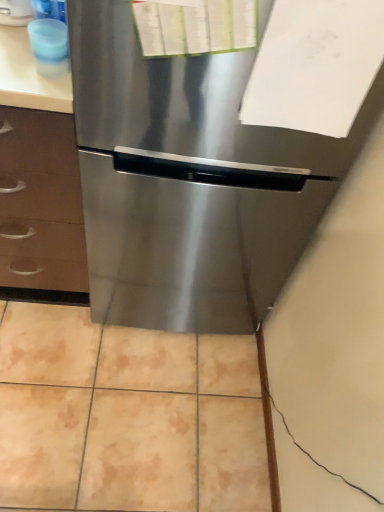
Describe the element at coordinates (315, 65) in the screenshot. The height and width of the screenshot is (512, 384). I see `white matte paper at upper right` at that location.

Where is `beige ceramic tile at center`? Image resolution: width=384 pixels, height=512 pixels. beige ceramic tile at center is located at coordinates (127, 416).

This screenshot has width=384, height=512. What do you see at coordinates (189, 181) in the screenshot?
I see `stainless steel refrigerator at center` at bounding box center [189, 181].

At what (x,y) coordinates should I click in order to perform the action: click on white matte paper at upper right. Please return your answer as a coordinate pair (x, y). The height and width of the screenshot is (512, 384). Looking at the image, I should click on (315, 65).

Considering the points (362, 60) and (267, 482), which point is in front, point (362, 60) or point (267, 482)?

Positioned in front is point (362, 60).

Measure the distance between white matte paper at upper right and beige ceramic tile at center.

white matte paper at upper right is 3.36 feet from beige ceramic tile at center.

Which object is closer to the camera, white matte paper at upper right or beige ceramic tile at center?

Positioned in front is white matte paper at upper right.

Is white matte paper at upper right smaller than beige ceramic tile at center?

Correct, white matte paper at upper right occupies less space than beige ceramic tile at center.

Can you tell me how much stainless steel refrigerator at center and beige ceramic tile at center differ in facing direction?

There is a 91.3-degree angle between the facing directions of stainless steel refrigerator at center and beige ceramic tile at center.

Is stainless steel refrigerator at center looking in the opposite direction of beige ceramic tile at center?

No, stainless steel refrigerator at center is not facing the opposite direction of beige ceramic tile at center.

Between stainless steel refrigerator at center and beige ceramic tile at center, which one has larger size?

stainless steel refrigerator at center is bigger.

Is stainless steel refrigerator at center touching beige ceramic tile at center?

No, stainless steel refrigerator at center is not next to beige ceramic tile at center.

In the scene shown: Considering the relative positions of stainless steel refrigerator at center and translucent blue cup at upper left in the image provided, is stainless steel refrigerator at center behind translucent blue cup at upper left?

No, stainless steel refrigerator at center is closer to the viewer.

Does point (146, 74) come behind point (30, 35)?

No, it is not.

From the image's perspective, is stainless steel refrigerator at center located above or below translucent blue cup at upper left?

From the image's perspective, stainless steel refrigerator at center appears below translucent blue cup at upper left.

Is stainless steel refrigerator at center spatially inside translucent blue cup at upper left, or outside of it?

stainless steel refrigerator at center is spatially situated outside translucent blue cup at upper left.

Can you tell me how much beige ceramic tile at center and stainless steel refrigerator at center differ in facing direction?

There is a 91.3-degree angle between the facing directions of beige ceramic tile at center and stainless steel refrigerator at center.

Is beige ceramic tile at center behind stainless steel refrigerator at center?

Yes.

Considering the relative sizes of beige ceramic tile at center and stainless steel refrigerator at center in the image provided, is beige ceramic tile at center shorter than stainless steel refrigerator at center?

Indeed, beige ceramic tile at center has a lesser height compared to stainless steel refrigerator at center.

Considering the sizes of objects beige ceramic tile at center and stainless steel refrigerator at center in the image provided, who is bigger, beige ceramic tile at center or stainless steel refrigerator at center?

stainless steel refrigerator at center is bigger.

Is stainless steel refrigerator at center directly adjacent to white matte paper at upper right?

No.

From their relative heights in the image, would you say stainless steel refrigerator at center is taller or shorter than white matte paper at upper right?

In the image, stainless steel refrigerator at center appears to be taller than white matte paper at upper right.

Does stainless steel refrigerator at center appear on the left side of white matte paper at upper right?

Yes.

From the image's perspective, is stainless steel refrigerator at center beneath white matte paper at upper right?

Yes, from the image's perspective, stainless steel refrigerator at center is beneath white matte paper at upper right.

Choose the correct answer: Is beige ceramic tile at center inside white matte paper at upper right or outside it?

beige ceramic tile at center is not enclosed by white matte paper at upper right.

Looking at their sizes, would you say beige ceramic tile at center is wider or thinner than white matte paper at upper right?

Clearly, beige ceramic tile at center has more width compared to white matte paper at upper right.

From the picture: Does beige ceramic tile at center turn towards white matte paper at upper right?

No, beige ceramic tile at center is not facing towards white matte paper at upper right.

Is beige ceramic tile at center bigger than white matte paper at upper right?

Indeed, beige ceramic tile at center has a larger size compared to white matte paper at upper right.

In the scene shown: From a real-world perspective, is translucent blue cup at upper left positioned under white matte paper at upper right based on gravity?

Indeed, from a real-world perspective, translucent blue cup at upper left is positioned beneath white matte paper at upper right.

Is translucent blue cup at upper left positioned with its back to white matte paper at upper right?

No, white matte paper at upper right is not at the back of translucent blue cup at upper left.

How many degrees apart are the facing directions of translucent blue cup at upper left and white matte paper at upper right?

2.48 degrees separate the facing orientations of translucent blue cup at upper left and white matte paper at upper right.

Can you see translucent blue cup at upper left touching white matte paper at upper right?

No, translucent blue cup at upper left is not beside white matte paper at upper right.

You are a GUI agent. You are given a task and a screenshot of the screen. Output one action in this format:
    pyautogui.click(x=<x>, y=<y>)
    Task: Click on the paper located on the right of beige ceramic tile at center
    The image size is (384, 512).
    Given the screenshot: What is the action you would take?
    pyautogui.click(x=315, y=65)

At what (x,y) coordinates should I click in order to perform the action: click on refrigerator above the beige ceramic tile at center (from a real-world perspective). Please return your answer as a coordinate pair (x, y). This screenshot has width=384, height=512. Looking at the image, I should click on (189, 181).

Looking at the image, which one is located closer to translucent blue cup at upper left, white matte paper at upper right or beige ceramic tile at center?

white matte paper at upper right.

In the scene shown: Considering their positions, is stainless steel refrigerator at center positioned further to translucent blue cup at upper left than white matte paper at upper right?

Based on the image, white matte paper at upper right appears to be further to translucent blue cup at upper left.

Considering their positions, is beige ceramic tile at center positioned further to translucent blue cup at upper left than white matte paper at upper right?

beige ceramic tile at center.

When comparing their distances from white matte paper at upper right, does translucent blue cup at upper left or beige ceramic tile at center seem further?

beige ceramic tile at center is further to white matte paper at upper right.

Based on their spatial positions, is stainless steel refrigerator at center or translucent blue cup at upper left closer to white matte paper at upper right?

stainless steel refrigerator at center is positioned closer to the anchor white matte paper at upper right.

From the image, which object appears to be nearer to stainless steel refrigerator at center, white matte paper at upper right or beige ceramic tile at center?

white matte paper at upper right lies closer to stainless steel refrigerator at center than the other object.

From the image, which object appears to be farther from white matte paper at upper right, beige ceramic tile at center or translucent blue cup at upper left?

Based on the image, beige ceramic tile at center appears to be further to white matte paper at upper right.

Looking at the image, which one is located closer to translucent blue cup at upper left, stainless steel refrigerator at center or beige ceramic tile at center?

stainless steel refrigerator at center.

The height and width of the screenshot is (512, 384). Find the location of `refrigerator between translucent blue cup at upper left and white matte paper at upper right`. refrigerator between translucent blue cup at upper left and white matte paper at upper right is located at coordinates (189, 181).

Locate an element on the screen. This screenshot has height=512, width=384. paper that lies between translucent blue cup at upper left and beige ceramic tile at center from top to bottom is located at coordinates (315, 65).

Where is `refrigerator between white matte paper at upper right and beige ceramic tile at center from top to bottom`? The image size is (384, 512). refrigerator between white matte paper at upper right and beige ceramic tile at center from top to bottom is located at coordinates (189, 181).

Where is `refrigerator between translucent blue cup at upper left and beige ceramic tile at center from top to bottom`? The image size is (384, 512). refrigerator between translucent blue cup at upper left and beige ceramic tile at center from top to bottom is located at coordinates (189, 181).